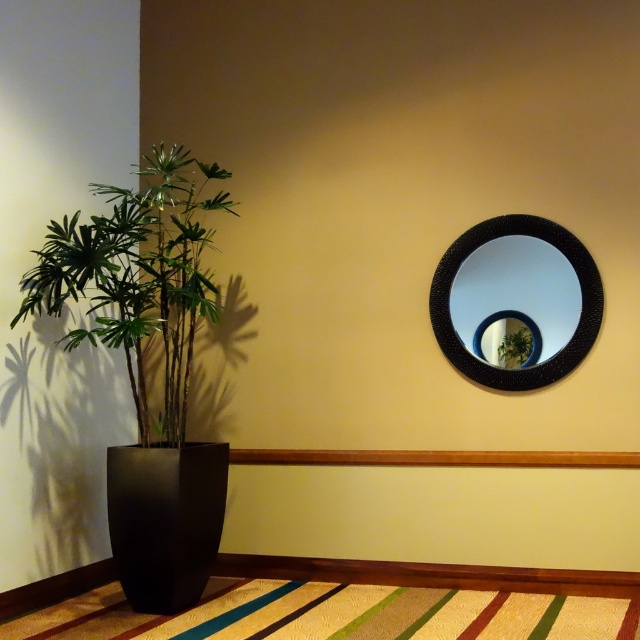
Can you confirm if green matte plant at left is positioned above black matte vase at left?

Yes, green matte plant at left is above black matte vase at left.

Does point (115, 244) come behind point (152, 460)?

Yes, point (115, 244) is behind point (152, 460).

Where is `green matte plant at left`? green matte plant at left is located at coordinates (138, 276).

Find the location of a particular element. Image resolution: width=640 pixels, height=640 pixels. striped carpet at lower center is located at coordinates (333, 614).

Is striped carpet at lower center below green leafy plant at upper right?

Yes.

Which is in front, point (29, 614) or point (531, 337)?

Point (29, 614)

This screenshot has height=640, width=640. In order to click on striped carpet at lower center in this screenshot , I will do `click(333, 614)`.

Does green matte plant at left have a greater width compared to black textured mirror at upper right?

Yes, green matte plant at left is wider than black textured mirror at upper right.

This screenshot has height=640, width=640. What do you see at coordinates (138, 276) in the screenshot? I see `green matte plant at left` at bounding box center [138, 276].

Who is more distant from viewer, (x=173, y=340) or (x=516, y=376)?

The point (x=516, y=376) is behind.

Where is `green matte plant at left`? Image resolution: width=640 pixels, height=640 pixels. green matte plant at left is located at coordinates (138, 276).